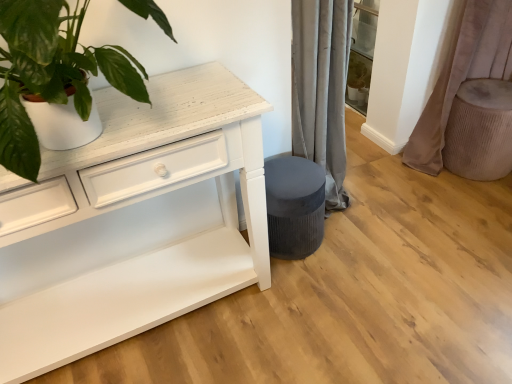
Locate an element on the screen. free area in between beige textured ottoman at right and velvet beige curtain at right is located at coordinates (442, 183).